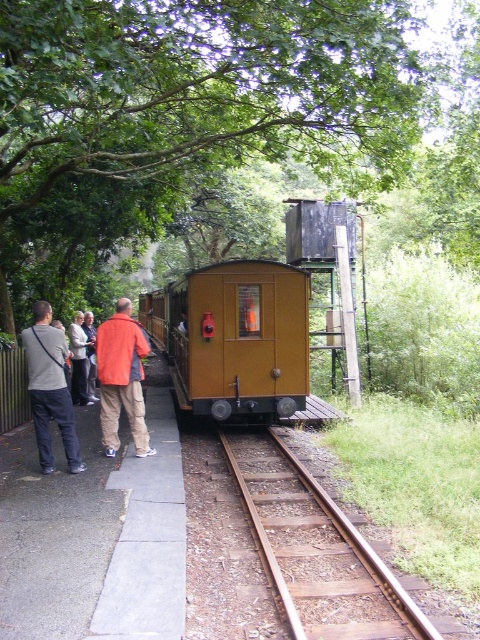
Can you confirm if orange jacket at center is taller than gray cotton shirt at left?

In fact, orange jacket at center may be shorter than gray cotton shirt at left.

Is orange jacket at center above gray cotton shirt at left?

No, orange jacket at center is not above gray cotton shirt at left.

Is point (143, 401) behind point (69, 440)?

That is True.

Where is `orange jacket at center`? The image size is (480, 640). orange jacket at center is located at coordinates (121, 378).

Can you confirm if matte yellow train at center is taller than gray cotton shirt at left?

Yes.

Does matte yellow train at center appear on the left side of gray cotton shirt at left?

Yes, matte yellow train at center is to the left of gray cotton shirt at left.

Image resolution: width=480 pixels, height=640 pixels. In order to click on matte yellow train at center in this screenshot , I will do coord(235,337).

Locate an element on the screen. matte yellow train at center is located at coordinates (235, 337).

Does matte yellow train at center have a greater width compared to orange shirt at left?

Yes.

Image resolution: width=480 pixels, height=640 pixels. I want to click on matte yellow train at center, so click(235, 337).

Between point (200, 275) and point (75, 364), which one is positioned behind?

Point (75, 364)

Locate an element on the screen. matte yellow train at center is located at coordinates (235, 337).